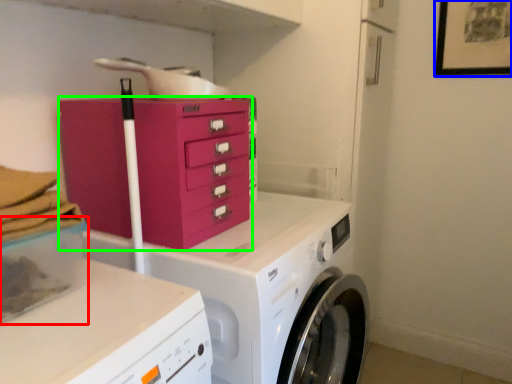
Question: Estimate the real-world distances between objects in this image. Which object is farther from storage box (highlighted by a red box), picture frame (highlighted by a blue box) or chest of drawers (highlighted by a green box)?

Choices:
 (A) picture frame
 (B) chest of drawers

Answer: (A)